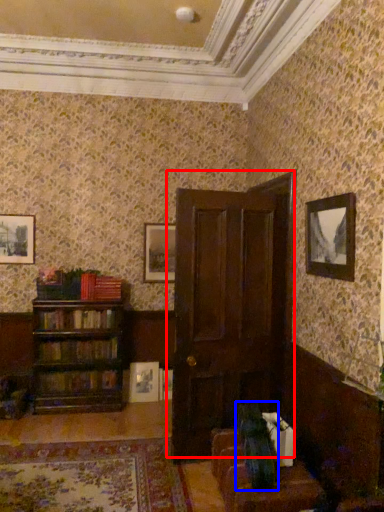
Question: Among these objects, which one is farthest to the camera, door (highlighted by a red box) or swivel chair (highlighted by a blue box)?

Choices:
 (A) door
 (B) swivel chair

Answer: (A)